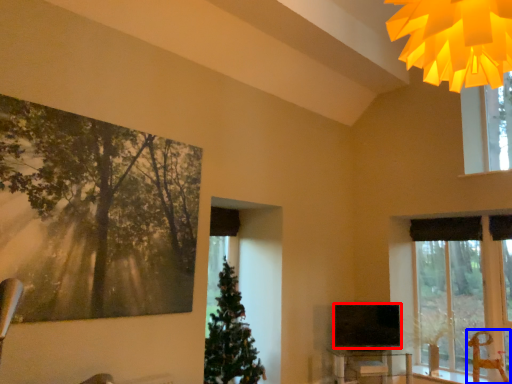
Question: Which of the following is the closest to the observer, television (highlighted by a red box) or swivel chair (highlighted by a blue box)?

Choices:
 (A) television
 (B) swivel chair

Answer: (B)